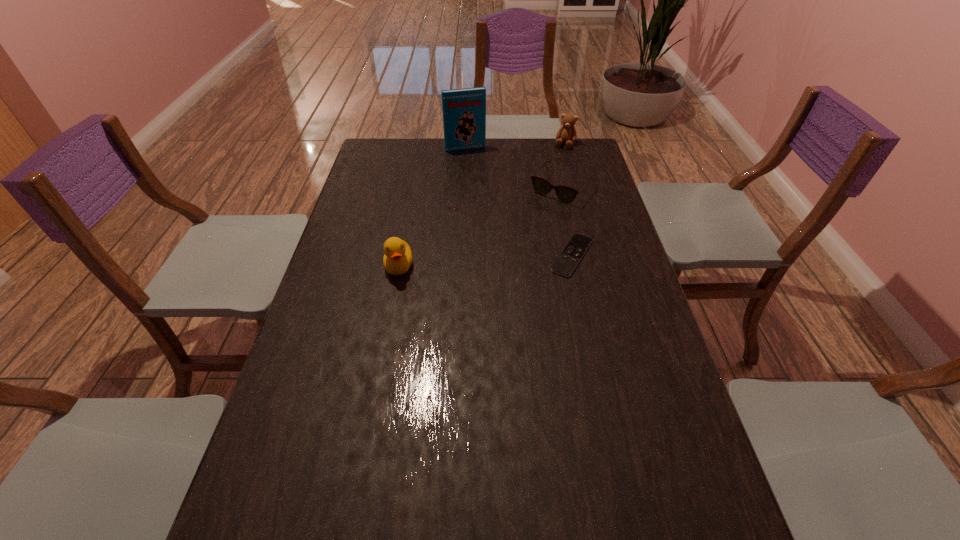
At what (x,y) coordinates should I click in order to perform the action: click on remote control located at the right edge. Please return your answer as a coordinate pair (x, y). Looking at the image, I should click on (567, 261).

The height and width of the screenshot is (540, 960). I want to click on teddy bear at the right edge, so click(x=567, y=133).

Image resolution: width=960 pixels, height=540 pixels. I want to click on spectacles at the right edge, so click(x=566, y=194).

The image size is (960, 540). I want to click on object that is at the far right corner, so click(567, 133).

This screenshot has height=540, width=960. Identify the location of free space at the far edge of the desktop. (492, 144).

This screenshot has width=960, height=540. I want to click on free space at the left edge of the desktop, so click(273, 430).

This screenshot has width=960, height=540. I want to click on free space at the right edge of the desktop, so coord(611,376).

I want to click on free space at the far left corner of the desktop, so click(x=380, y=145).

This screenshot has width=960, height=540. In the image, there is a desktop. Identify the location of vacant space at the far right corner. (557, 166).

This screenshot has width=960, height=540. What are the coordinates of `vacant area that lies between the leftmost object and the third farthest object` in the screenshot? It's located at (480, 227).